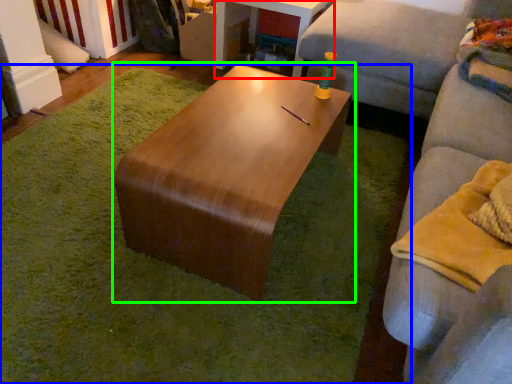
Question: Estimate the real-world distances between objects in this image. Which object is closer to table (highlighted by a red box), mat (highlighted by a blue box) or coffee table (highlighted by a green box)?

Choices:
 (A) mat
 (B) coffee table

Answer: (B)